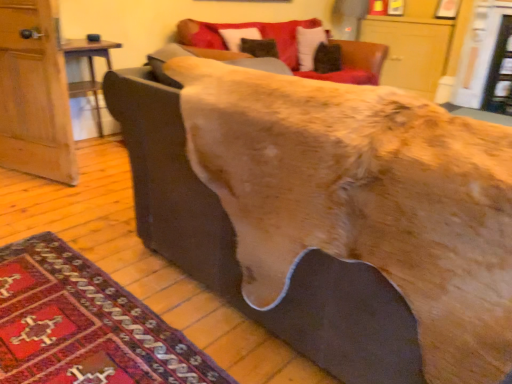
Question: Is brown leather couch at center positioned with its back to velvet-like brown pillow at upper center?

Choices:
 (A) yes
 (B) no

Answer: (B)

Question: Considering the relative sizes of brown leather couch at center and velvet-like brown pillow at upper center in the image provided, is brown leather couch at center thinner than velvet-like brown pillow at upper center?

Choices:
 (A) yes
 (B) no

Answer: (B)

Question: Can we say brown leather couch at center lies outside velvet-like brown pillow at upper center?

Choices:
 (A) no
 (B) yes

Answer: (B)

Question: From a real-world perspective, is brown leather couch at center positioned under velvet-like brown pillow at upper center based on gravity?

Choices:
 (A) yes
 (B) no

Answer: (A)

Question: Considering the relative sizes of brown leather couch at center and velvet-like brown pillow at upper center in the image provided, is brown leather couch at center taller than velvet-like brown pillow at upper center?

Choices:
 (A) yes
 (B) no

Answer: (A)

Question: Is wooden table at left bigger or smaller than brown leather couch at center?

Choices:
 (A) small
 (B) big

Answer: (A)

Question: Considering the positions of point (73, 84) and point (187, 180), is point (73, 84) closer or farther from the camera than point (187, 180)?

Choices:
 (A) farther
 (B) closer

Answer: (A)

Question: In terms of width, does wooden table at left look wider or thinner when compared to brown leather couch at center?

Choices:
 (A) wide
 (B) thin

Answer: (B)

Question: Is wooden table at left in front of or behind brown leather couch at center in the image?

Choices:
 (A) front
 (B) behind

Answer: (B)

Question: Would you say velvet-like brown pillow at upper center is to the left or to the right of brown leather couch at center in the picture?

Choices:
 (A) right
 (B) left

Answer: (A)

Question: Which is correct: velvet-like brown pillow at upper center is inside brown leather couch at center, or outside of it?

Choices:
 (A) inside
 (B) outside

Answer: (B)

Question: Is velvet-like brown pillow at upper center taller or shorter than brown leather couch at center?

Choices:
 (A) short
 (B) tall

Answer: (A)

Question: Based on their sizes in the image, would you say velvet-like brown pillow at upper center is bigger or smaller than brown leather couch at center?

Choices:
 (A) big
 (B) small

Answer: (B)

Question: Looking at the image, does carpeted rug at lower left seem bigger or smaller compared to brown leather couch at center?

Choices:
 (A) small
 (B) big

Answer: (A)

Question: Considering the positions of carpeted rug at lower left and brown leather couch at center in the image, is carpeted rug at lower left taller or shorter than brown leather couch at center?

Choices:
 (A) tall
 (B) short

Answer: (B)